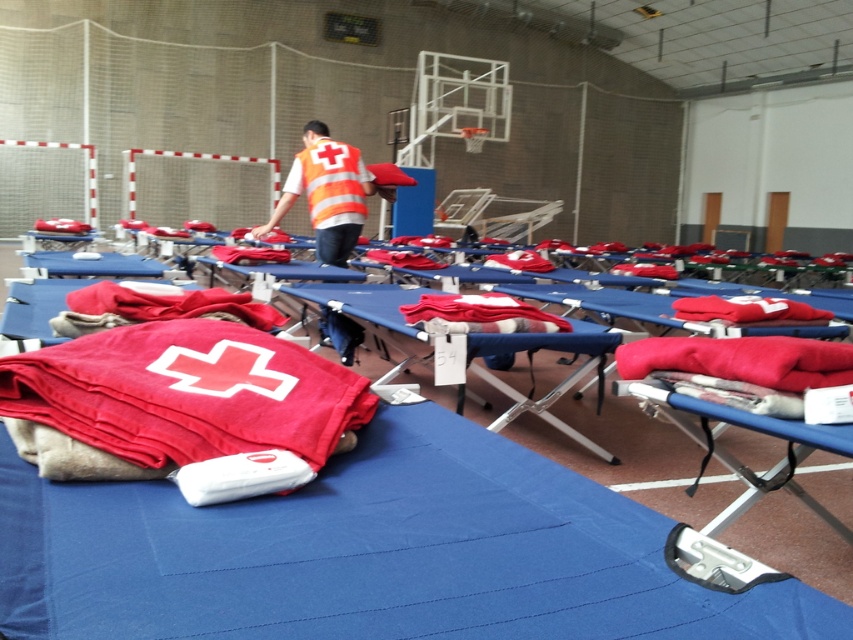
You are a relief worker in an emergency shelter. You need to quickly assess if the space between the blue fabric cot at center and the red soft blanket at center is sufficient to move a stretcher through. The stretcher requires 3 feet of clearance. Can you pass through?

The blue fabric cot at center and red soft blanket at center are 3.40 feet apart, which is more than the required 3 feet clearance. Yes, the stretcher can pass through.